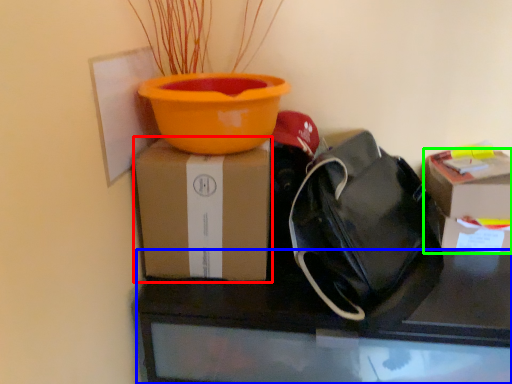
Question: Which object is the closest to the box (highlighted by a red box)? Choose among these: desk (highlighted by a blue box) or box (highlighted by a green box).

Choices:
 (A) desk
 (B) box

Answer: (A)